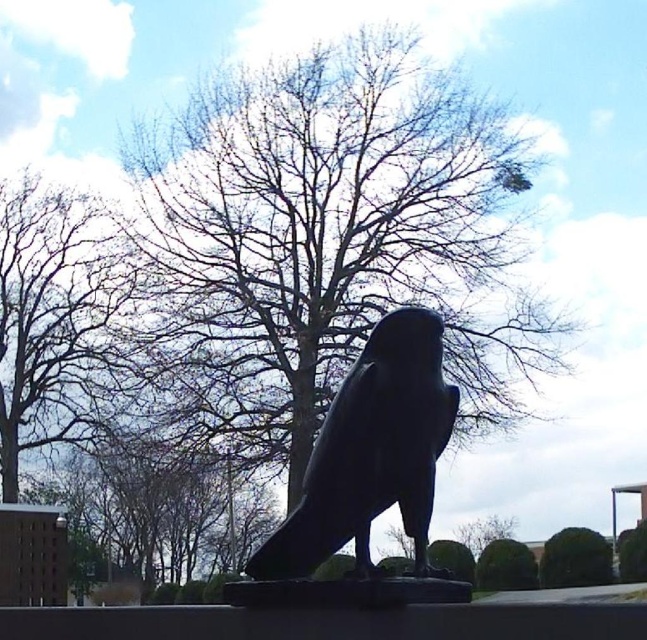
In the scene shown: You are a park visitor who wants to take a photo of the shiny black bird at center without the bare branches at upper left appearing in the frame. Given that your camera has a fixed focal length and you can only move forward or backward, which direction should you move to achieve this?

To avoid capturing the bare branches at upper left in the photo, you should move forward towards the shiny black bird at center. Since the bare branches at upper left and shiny black bird at center are 38.49 meters apart, moving closer to the bird will reduce the field of view, making it easier to frame the bird without the branches in the background.

You are a photographer trying to capture the statue of a shiny black bird at center. The statue is represented by the point at coordinates point (x=371, y=452). To ensure the statue is centered in your photo, where should you position your camera relative to the point?

The statue of the shiny black bird at center is already positioned at the center coordinates point (x=371, y=452), so you should align your camera directly facing this point to ensure the statue is centered in your photo.